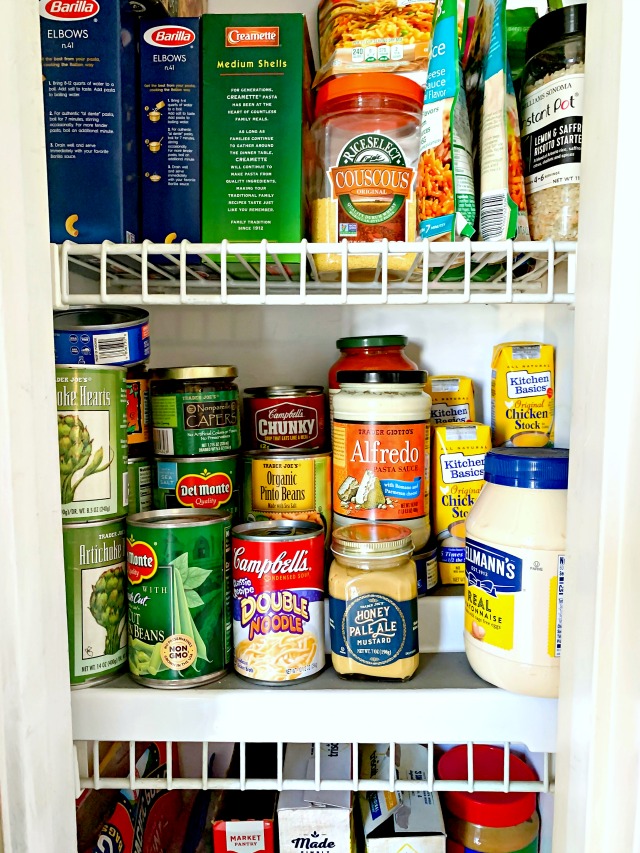
The height and width of the screenshot is (853, 640). Identify the location of jars. (377, 612), (492, 817), (525, 594), (404, 427), (388, 351), (374, 136), (578, 53), (198, 413).